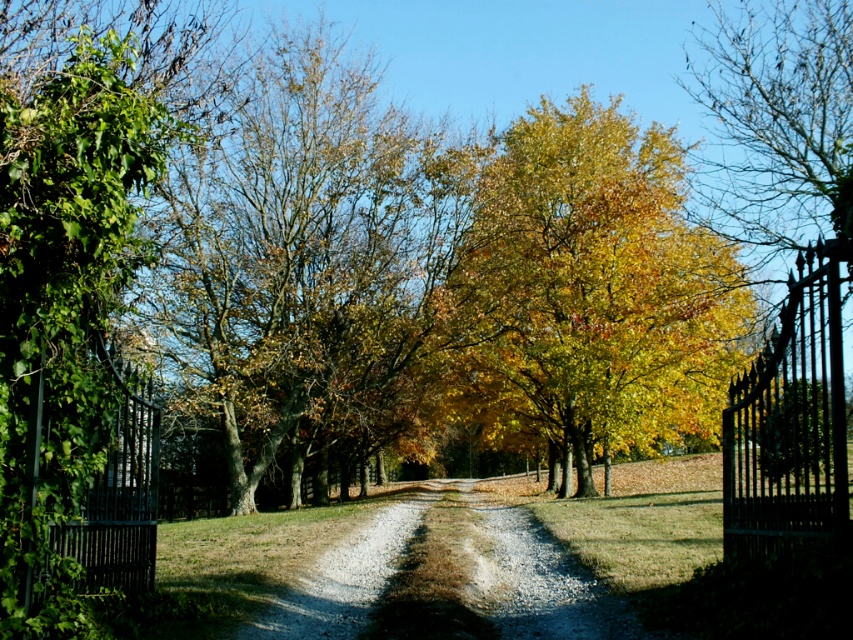
Question: Can you confirm if green leafy tree at center is positioned to the right of golden yellow leaves at center?

Choices:
 (A) no
 (B) yes

Answer: (A)

Question: Which of these objects is positioned farthest from the green leafy tree at center?

Choices:
 (A) gravelly dirt road at center
 (B) black wrought iron gate at right

Answer: (B)

Question: Which object is positioned closest to the golden yellow leaves at center?

Choices:
 (A) black wrought iron gate at right
 (B) gravelly dirt road at center
 (C) black wrought iron gate at left

Answer: (B)

Question: Can you confirm if golden yellow leaves at center is positioned above black wrought iron gate at left?

Choices:
 (A) yes
 (B) no

Answer: (A)

Question: Can you confirm if golden yellow leaves at center is positioned below black wrought iron gate at left?

Choices:
 (A) no
 (B) yes

Answer: (A)

Question: Which of these objects is positioned farthest from the gravelly dirt road at center?

Choices:
 (A) golden yellow leaves at center
 (B) black wrought iron gate at right
 (C) black wrought iron gate at left

Answer: (B)